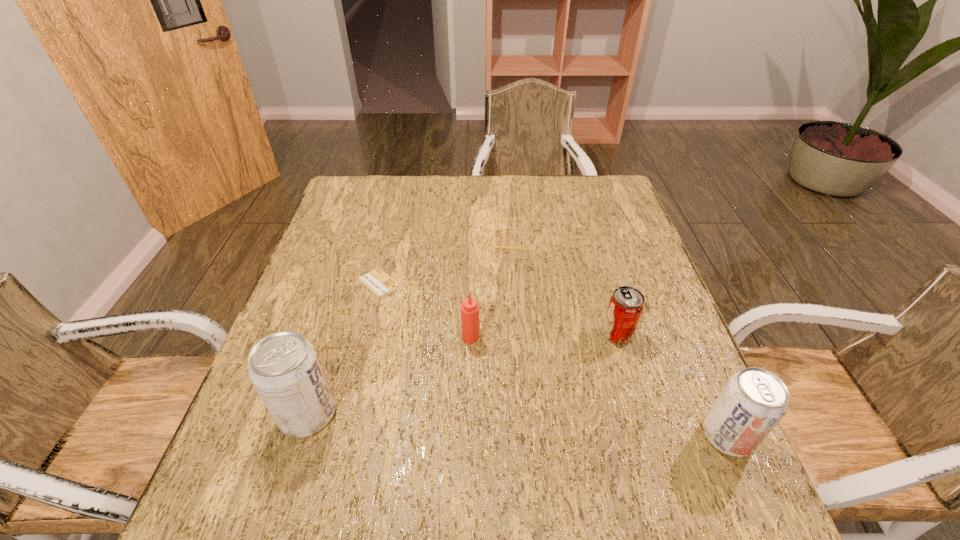
The height and width of the screenshot is (540, 960). Identify the location of empty location between the third object from left to right and the farthest object. (492, 290).

Locate an element on the screen. This screenshot has width=960, height=540. empty space that is in between the farthest pop soda and the identity card is located at coordinates (498, 308).

You are a GUI agent. You are given a task and a screenshot of the screen. Output one action in this format:
    pyautogui.click(x=<x>, y=<y>)
    Task: Click on the free area in between the tallest pop soda and the rightmost pop soda
    The image size is (960, 540).
    Given the screenshot: What is the action you would take?
    pyautogui.click(x=517, y=424)

Identify the location of blank region between the rightmost pop soda and the fifth nearest object. This screenshot has width=960, height=540. (553, 359).

Where is `vacant space that's between the rightmost object and the Tabasco sauce`? The height and width of the screenshot is (540, 960). vacant space that's between the rightmost object and the Tabasco sauce is located at coordinates point(599,386).

Find the location of a particular element. Image resolution: width=960 pixels, height=540 pixels. vacant area that lies between the third object from left to right and the rightmost pop soda is located at coordinates (599, 386).

Where is `free space between the farthest pop soda and the Tabasco sauce`? The image size is (960, 540). free space between the farthest pop soda and the Tabasco sauce is located at coordinates (544, 335).

Where is `vacant point located between the identity card and the rightmost object`? This screenshot has height=540, width=960. vacant point located between the identity card and the rightmost object is located at coordinates (553, 359).

Identify the location of empty location between the shortest object and the fifth object from left to right. (498, 308).

Where is `blank region between the third object from left to right and the leftmost pop soda`? blank region between the third object from left to right and the leftmost pop soda is located at coordinates (389, 375).